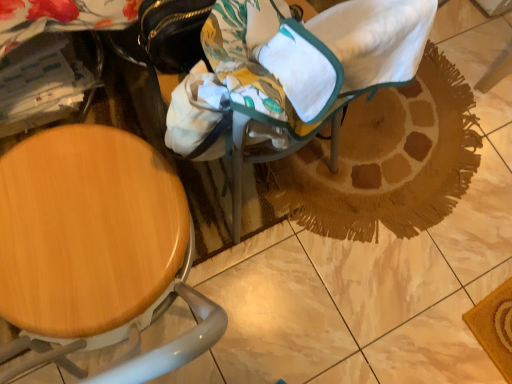
Identify the location of vacant space situated above brown woven mat at center (from a real-world perspective). (368, 142).